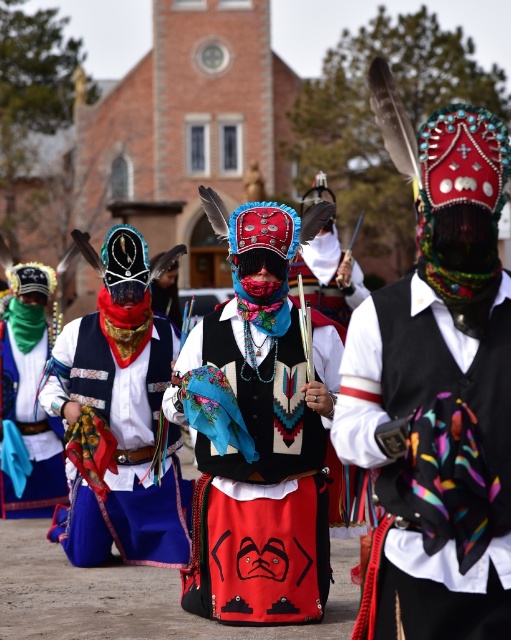
Who is taller, blue fabric skirt at center or green satin scarf at left?

green satin scarf at left

Find the location of a particular element. blue fabric skirt at center is located at coordinates (123, 451).

Find the location of `blue fabric skirt at center`. blue fabric skirt at center is located at coordinates (123, 451).

Is embroidered fabric skirt at center smaller than green satin scarf at left?

No.

From the picture: Can you confirm if embroidered fabric skirt at center is wider than green satin scarf at left?

Yes.

Is point (294, 420) in front of point (7, 337)?

Yes, it is in front of point (7, 337).

Find the location of a particular element. Image resolution: width=511 pixels, height=640 pixels. embroidered fabric skirt at center is located at coordinates (261, 486).

From the picture: Who is shorter, multicolored woven scarf at center or blue fabric skirt at center?

multicolored woven scarf at center is shorter.

Looking at this image, is multicolored woven scarf at center closer to camera compared to blue fabric skirt at center?

That is True.

This screenshot has width=511, height=640. I want to click on multicolored woven scarf at center, so pyautogui.click(x=430, y=461).

Where is `multicolored woven scarf at center`? multicolored woven scarf at center is located at coordinates (430, 461).